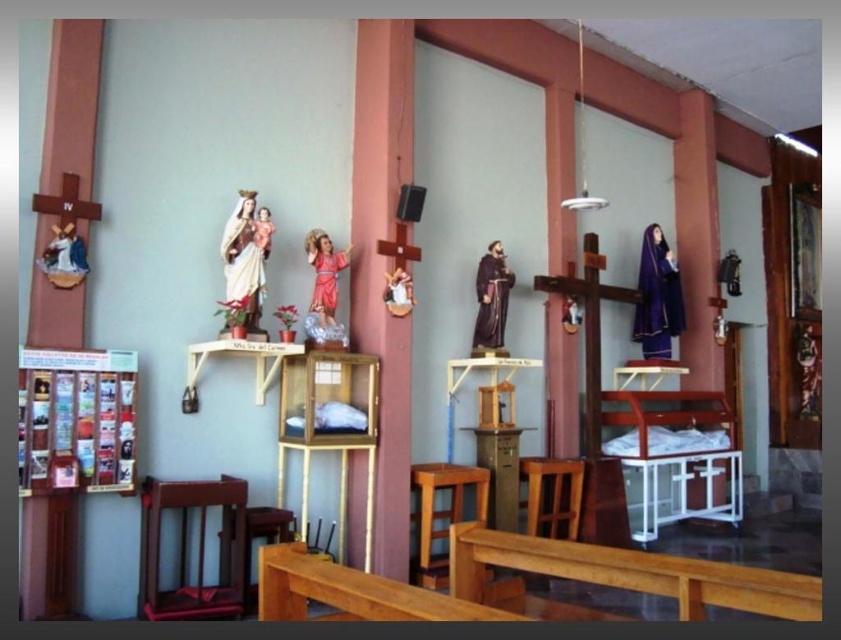
Question: Which point is closer to the camera taking this photo?

Choices:
 (A) (182, 588)
 (B) (294, 442)
 (C) (537, 467)
 (D) (437, 577)

Answer: (A)

Question: Which point appears closest to the camera in this image?

Choices:
 (A) (188, 484)
 (B) (461, 468)

Answer: (A)

Question: Can you confirm if wooden cabinet at center is wider than wooden stool at lower center?

Choices:
 (A) yes
 (B) no

Answer: (A)

Question: Does wooden chair at lower left appear under wooden chair at center?

Choices:
 (A) yes
 (B) no

Answer: (B)

Question: Does wooden chair at lower left come behind wooden chair at center?

Choices:
 (A) no
 (B) yes

Answer: (A)

Question: Which of the following is the farthest from the observer?

Choices:
 (A) wooden chair at lower left
 (B) wooden chair at center

Answer: (B)